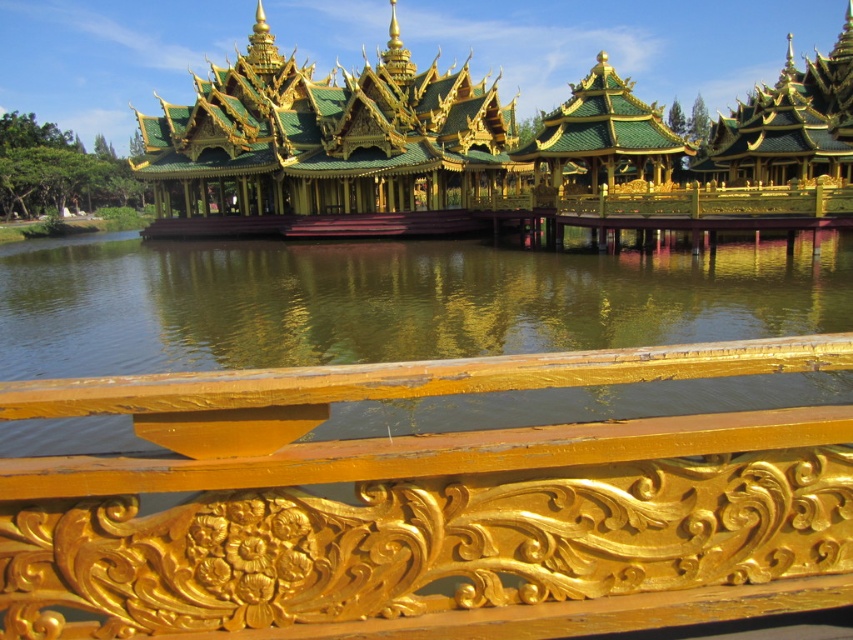
What do you see at coordinates (387, 300) in the screenshot?
I see `green reflective water at center` at bounding box center [387, 300].

The image size is (853, 640). Identify the location of green reflective water at center. (387, 300).

Who is more forward, (659, 406) or (677, 216)?

Point (659, 406) is more forward.

The height and width of the screenshot is (640, 853). I want to click on green reflective water at center, so click(x=387, y=300).

Is gold carved wood rail at center positioned at the back of green reflective water at center?

Yes, it is behind green reflective water at center.

Is gold carved wood rail at center thinner than green reflective water at center?

Indeed, gold carved wood rail at center has a lesser width compared to green reflective water at center.

Does point (744, 557) come closer to viewer compared to point (134, 243)?

Yes.

Find the location of `gold carved wood rail at center`. gold carved wood rail at center is located at coordinates (428, 506).

Can you confirm if gold carved wood rail at center is positioned to the left of gold/gilded wood palace at center?

Correct, you'll find gold carved wood rail at center to the left of gold/gilded wood palace at center.

Is point (148, 630) positioned before point (645, 124)?

Yes, it is.

Where is `gold carved wood rail at center`? gold carved wood rail at center is located at coordinates (428, 506).